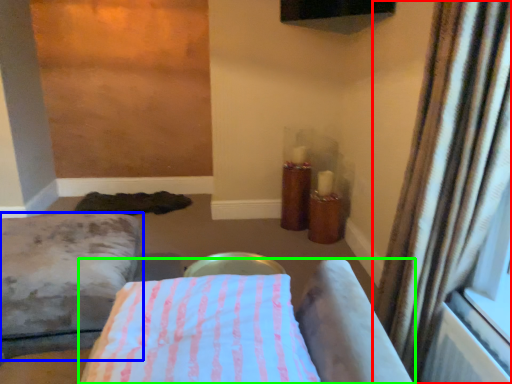
Question: Considering the real-world distances, which object is closest to curtain (highlighted by a red box)? furniture (highlighted by a blue box) or furniture (highlighted by a green box).

Choices:
 (A) furniture
 (B) furniture

Answer: (B)